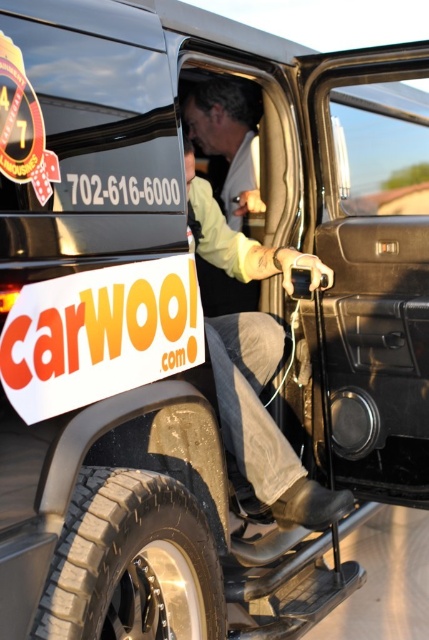
Can you confirm if black rubber tire at lower left is taller than denim pants at lower center?

No.

Can you confirm if black rubber tire at lower left is smaller than denim pants at lower center?

Yes.

You are a GUI agent. You are given a task and a screenshot of the screen. Output one action in this format:
    pyautogui.click(x=<x>, y=<y>)
    Task: Click on the black rubber tire at lower left
    The height and width of the screenshot is (640, 429).
    Given the screenshot: What is the action you would take?
    [132, 563]

I want to click on black rubber tire at lower left, so pyautogui.click(x=132, y=563).